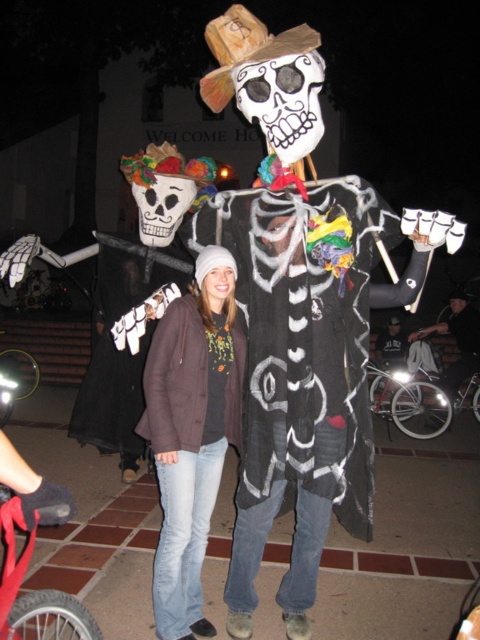
You are a photographer trying to capture a photo of the denim jeans at center and the dark gray fabric pants at lower right. Which object should you focus on first if you want to ensure both are in focus without adjusting the camera settings?

The denim jeans at center should be focused on first because it is much taller than the dark gray fabric pants at lower right, so focusing on the taller object will help keep both in focus.